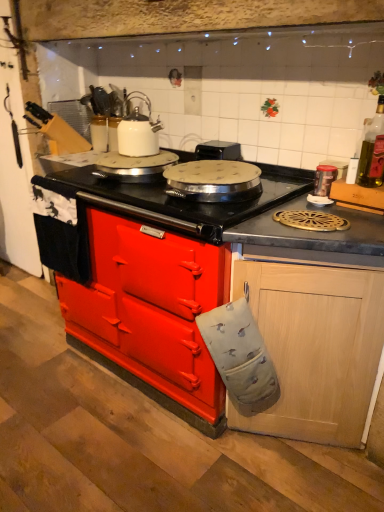
You are a GUI agent. You are given a task and a screenshot of the screen. Output one action in this format:
    pyautogui.click(x=<x>, y=<y>)
    Task: Click on the free point above light wood/texture cabinet at lower right (from a real-world perspective)
    The width and height of the screenshot is (384, 512).
    Given the screenshot: What is the action you would take?
    pyautogui.click(x=323, y=220)